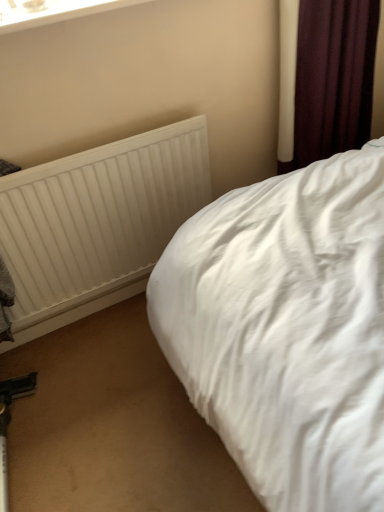
Question: Does dark purple fabric at upper right appear on the left side of white plastic window frame at upper left?

Choices:
 (A) no
 (B) yes

Answer: (A)

Question: Is there a large distance between dark purple fabric at upper right and white plastic window frame at upper left?

Choices:
 (A) yes
 (B) no

Answer: (B)

Question: Can you confirm if dark purple fabric at upper right is shorter than white plastic window frame at upper left?

Choices:
 (A) yes
 (B) no

Answer: (B)

Question: Is dark purple fabric at upper right thinner than white plastic window frame at upper left?

Choices:
 (A) yes
 (B) no

Answer: (B)

Question: Is dark purple fabric at upper right facing away from white plastic window frame at upper left?

Choices:
 (A) yes
 (B) no

Answer: (B)

Question: Is white plastic window frame at upper left inside the boundaries of white cotton bed at center, or outside?

Choices:
 (A) inside
 (B) outside

Answer: (B)

Question: In the image, is white plastic window frame at upper left positioned in front of or behind white cotton bed at center?

Choices:
 (A) behind
 (B) front

Answer: (A)

Question: In terms of height, does white plastic window frame at upper left look taller or shorter compared to white cotton bed at center?

Choices:
 (A) short
 (B) tall

Answer: (A)

Question: From the image's perspective, is white plastic window frame at upper left located above or below white cotton bed at center?

Choices:
 (A) below
 (B) above

Answer: (B)

Question: From the image's perspective, is white textured radiator at upper left positioned above or below white plastic window frame at upper left?

Choices:
 (A) above
 (B) below

Answer: (B)

Question: From a real-world perspective, is white textured radiator at upper left physically located above or below white plastic window frame at upper left?

Choices:
 (A) below
 (B) above

Answer: (A)

Question: In terms of size, does white textured radiator at upper left appear bigger or smaller than white plastic window frame at upper left?

Choices:
 (A) big
 (B) small

Answer: (A)

Question: Is white textured radiator at upper left inside or outside of white plastic window frame at upper left?

Choices:
 (A) outside
 (B) inside

Answer: (A)

Question: From their relative heights in the image, would you say dark purple fabric at upper right is taller or shorter than white textured radiator at upper left?

Choices:
 (A) tall
 (B) short

Answer: (A)

Question: In terms of width, does dark purple fabric at upper right look wider or thinner when compared to white textured radiator at upper left?

Choices:
 (A) wide
 (B) thin

Answer: (A)